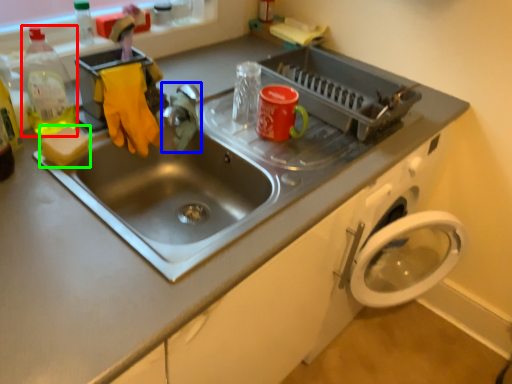
Question: Which object is the farthest from bottle (highlighted by a red box)? Choose among these: faucet (highlighted by a blue box) or soap (highlighted by a green box).

Choices:
 (A) faucet
 (B) soap

Answer: (A)